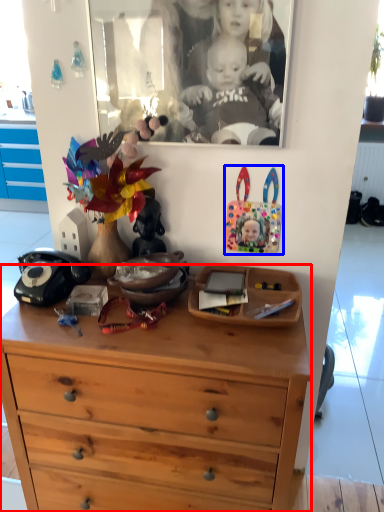
Question: Which object is closer to the camera taking this photo, chest of drawers (highlighted by a red box) or toy (highlighted by a blue box)?

Choices:
 (A) chest of drawers
 (B) toy

Answer: (A)